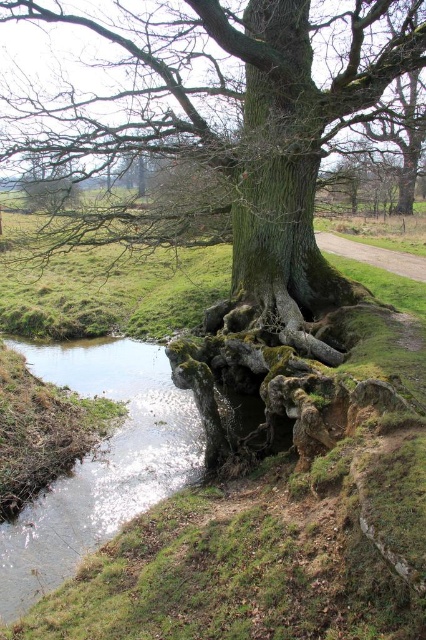
Who is shorter, green rough bark tree at center or clear water at lower left?

clear water at lower left

Who is more forward, [290,115] or [164,358]?

Positioned in front is point [290,115].

This screenshot has width=426, height=640. In order to click on green rough bark tree at center in this screenshot , I will do `click(207, 122)`.

Does green rough bark tree at center appear on the left side of green rough bark tree trunk at center?

Correct, you'll find green rough bark tree at center to the left of green rough bark tree trunk at center.

Between green rough bark tree at center and green rough bark tree trunk at center, which one appears on the left side from the viewer's perspective?

green rough bark tree at center is more to the left.

Locate an element on the screen. green rough bark tree at center is located at coordinates (207, 122).

Does clear water at lower left have a greater width compared to green rough bark tree trunk at center?

Yes, clear water at lower left is wider than green rough bark tree trunk at center.

Does clear water at lower left have a greater height compared to green rough bark tree trunk at center?

Incorrect, clear water at lower left's height is not larger of green rough bark tree trunk at center's.

Who is more forward, (25, 593) or (299, 228)?

Point (25, 593) is more forward.

At what (x,y) coordinates should I click in order to perform the action: click on clear water at lower left. Please return your answer as a coordinate pair (x, y). The image size is (426, 640). Looking at the image, I should click on (100, 461).